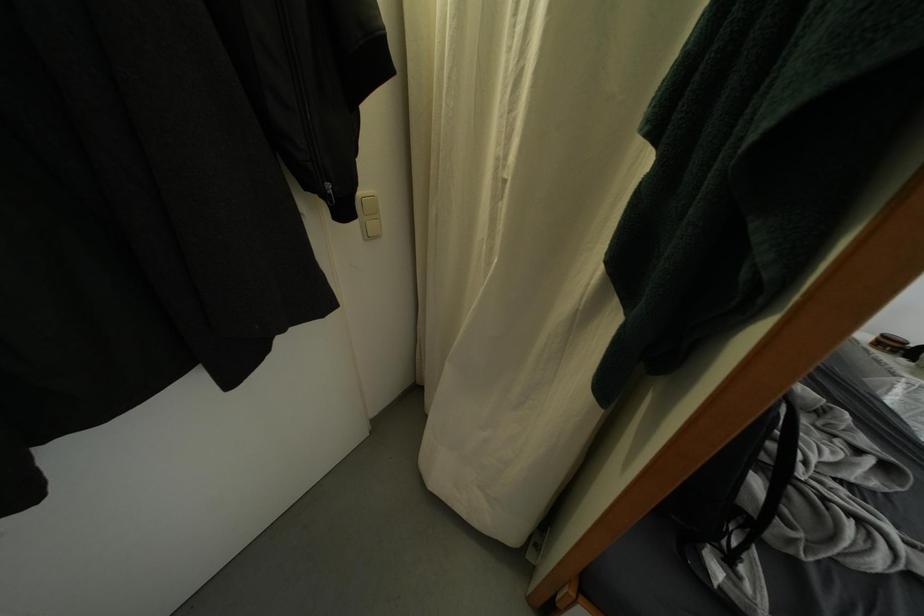
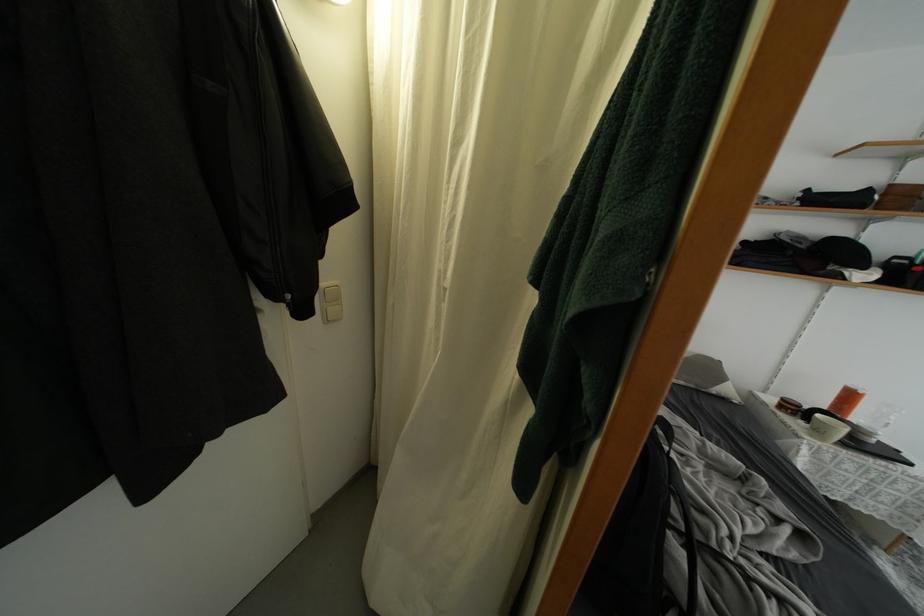
Question: Based on the continuous images, in which direction is the camera rotating? Reply with the corresponding letter.

Choices:
 (A) Left
 (B) Right
 (C) Up
 (D) Down

Answer: (C)